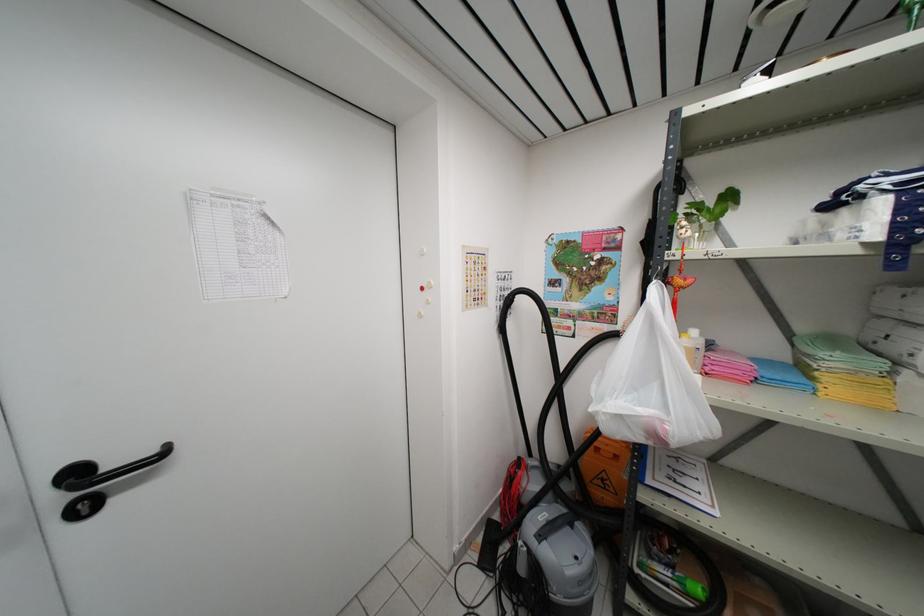
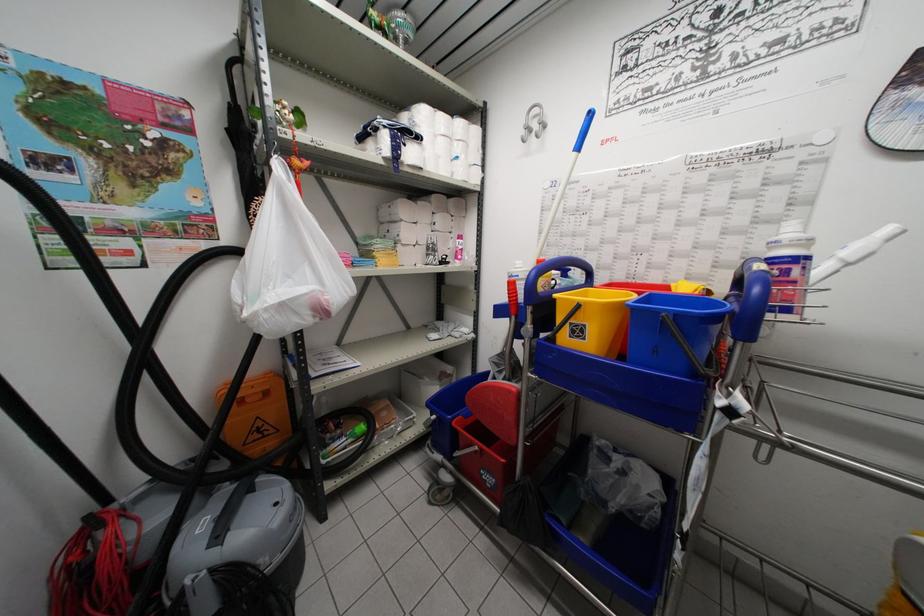
Question: Based on the continuous images, in which direction is the camera rotating? Reply with the corresponding letter.

Choices:
 (A) Left
 (B) Right
 (C) Up
 (D) Down

Answer: (B)